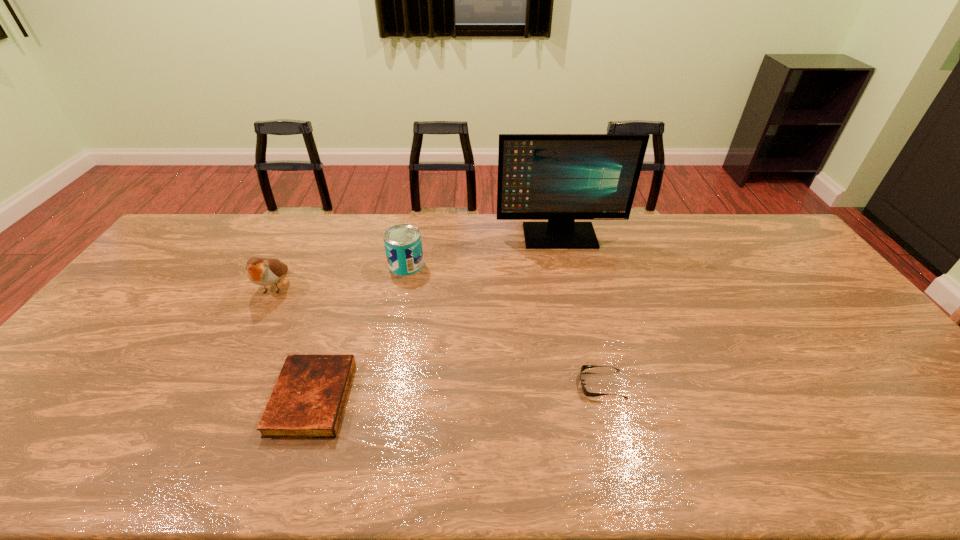
I want to click on free location located 0.120m at the face of the leftmost object, so click(x=249, y=337).

This screenshot has height=540, width=960. I want to click on vacant space situated on the left of the third object from left to right, so click(373, 265).

Where is `vacant space positioned on the spine side of the second shortest object`? This screenshot has width=960, height=540. vacant space positioned on the spine side of the second shortest object is located at coordinates (496, 398).

Locate an element on the screen. The image size is (960, 540). vacant space located 0.290m on the front-facing side of the shortest object is located at coordinates (466, 384).

Image resolution: width=960 pixels, height=540 pixels. In order to click on free space located on the front-facing side of the shortest object in this screenshot , I will do `click(477, 384)`.

This screenshot has height=540, width=960. Find the location of `vacant position located on the front-facing side of the shortest object`. vacant position located on the front-facing side of the shortest object is located at coordinates (434, 384).

Locate an element on the screen. Image resolution: width=960 pixels, height=540 pixels. object that is at the far edge is located at coordinates (561, 178).

You are a GUI agent. You are given a task and a screenshot of the screen. Output one action in this format:
    pyautogui.click(x=<x>, y=<y>)
    Task: Click on the vacant area at the far edge of the desktop
    
    Given the screenshot: What is the action you would take?
    pyautogui.click(x=257, y=233)

Where is `free space at the near edge of the desktop`? free space at the near edge of the desktop is located at coordinates (181, 478).

I want to click on vacant space at the left edge of the desktop, so [x=14, y=421].